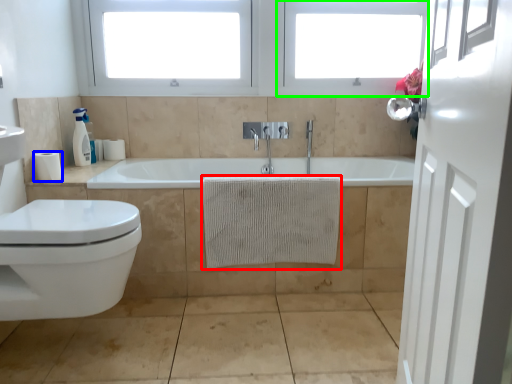
Question: Which is farther away from bath towel (highlighted by a red box)? toilet paper (highlighted by a blue box) or window frame (highlighted by a green box)?

Choices:
 (A) toilet paper
 (B) window frame

Answer: (B)